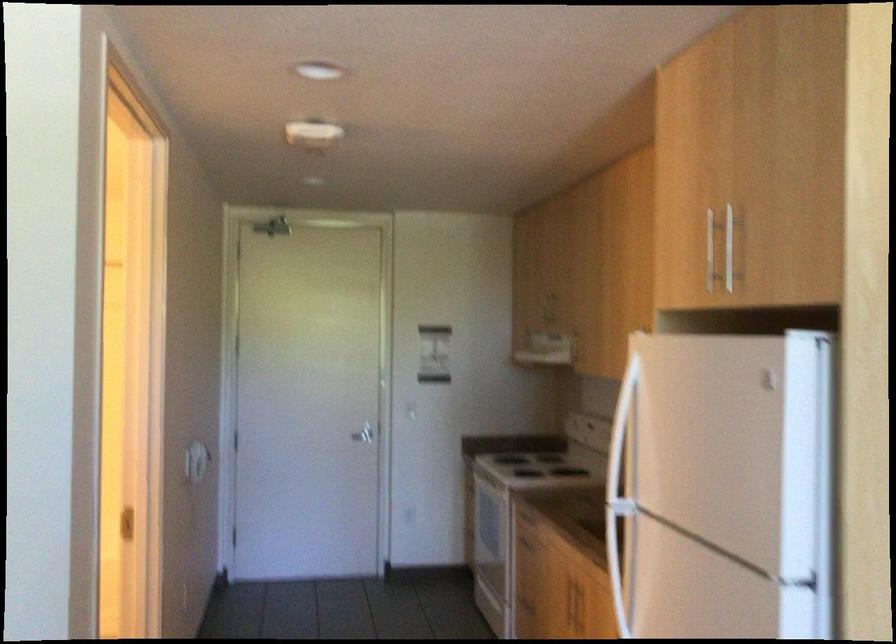
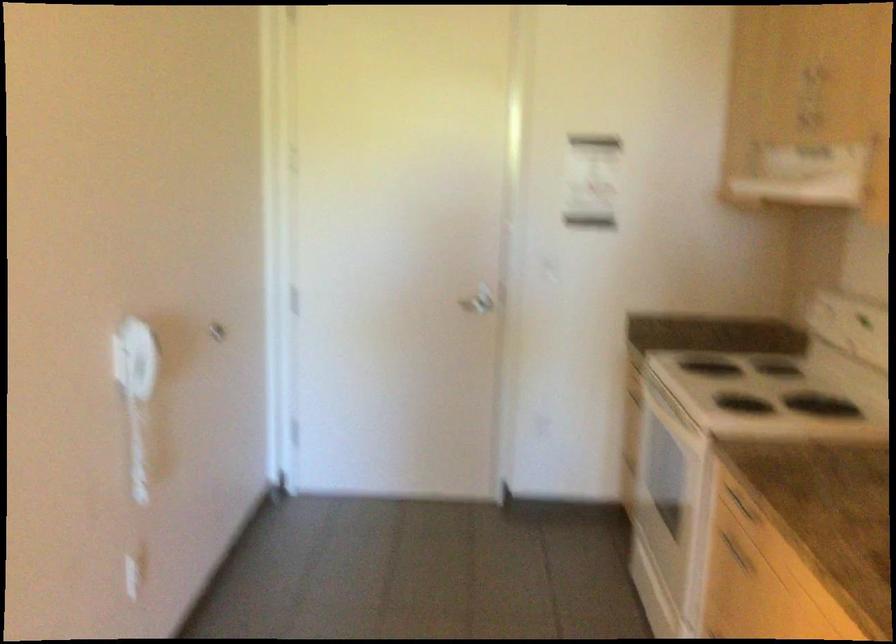
The point at [533,529] is marked in the first image. Where is the corresponding point in the second image?

(735, 552)